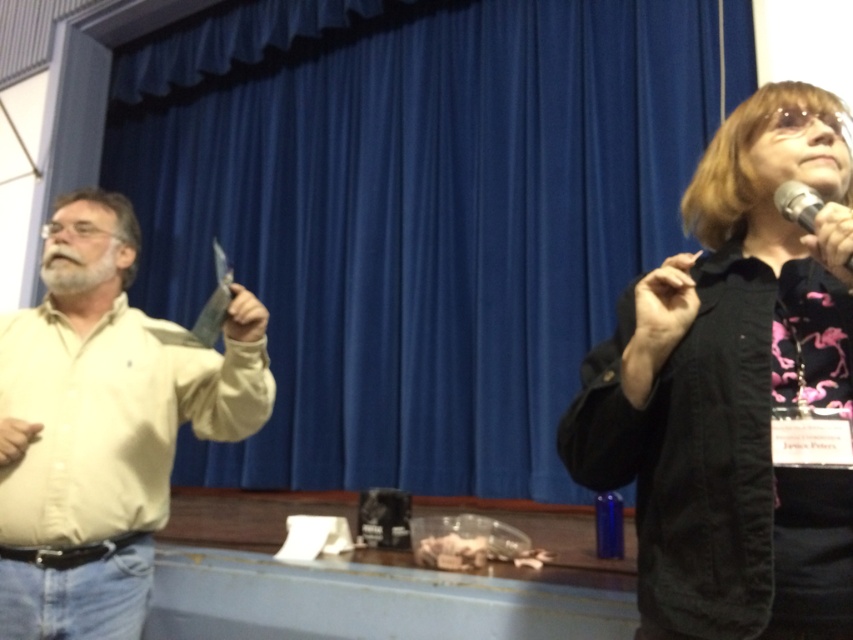
Question: Can you confirm if blue fabric curtain at center is smaller than light yellow shirt at left?

Choices:
 (A) no
 (B) yes

Answer: (A)

Question: Estimate the real-world distances between objects in this image. Which object is closer to the light yellow shirt at left?

Choices:
 (A) black metallic microphone at upper right
 (B) black matte jacket at upper right

Answer: (B)

Question: Which point is closer to the camera taking this photo?

Choices:
 (A) (196, 188)
 (B) (804, 212)
 (C) (48, 534)
 (D) (813, 136)

Answer: (B)

Question: Among these points, which one is farthest from the camera?

Choices:
 (A) (663, 449)
 (B) (410, 54)
 (C) (57, 424)
 (D) (804, 200)

Answer: (B)

Question: Can you confirm if blue fabric curtain at center is bigger than black matte jacket at upper right?

Choices:
 (A) no
 (B) yes

Answer: (B)

Question: Can you confirm if blue fabric curtain at center is positioned to the right of black matte jacket at upper right?

Choices:
 (A) yes
 (B) no

Answer: (B)